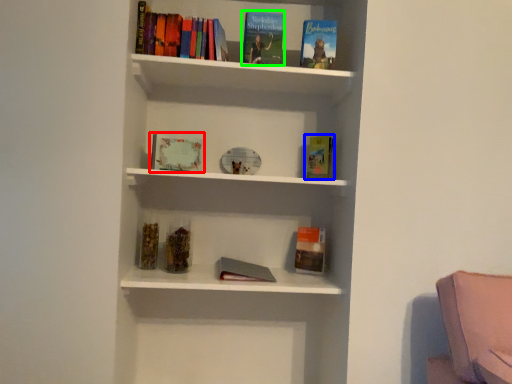
Question: Which is farther away from book (highlighted by a red box)? paperback book (highlighted by a blue box) or book (highlighted by a green box)?

Choices:
 (A) paperback book
 (B) book

Answer: (A)